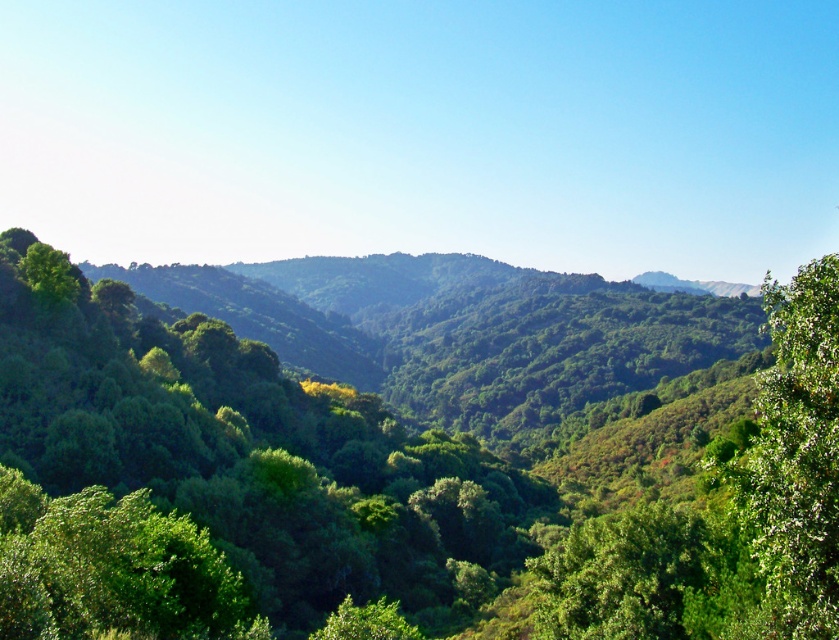
Question: Which point is closer to the camera taking this photo?

Choices:
 (A) (808, 570)
 (B) (150, 342)

Answer: (A)

Question: Can you confirm if green leafy tree at center is positioned below green leafy tree at right?

Choices:
 (A) no
 (B) yes

Answer: (B)

Question: Which point is farther to the camera?

Choices:
 (A) (665, 600)
 (B) (785, 340)

Answer: (A)

Question: Among these points, which one is nearest to the camera?

Choices:
 (A) (746, 620)
 (B) (827, 584)

Answer: (B)

Question: Is green leafy tree at center below green leafy tree at right?

Choices:
 (A) yes
 (B) no

Answer: (A)

Question: Does green leafy tree at center have a smaller size compared to green leafy tree at right?

Choices:
 (A) yes
 (B) no

Answer: (B)